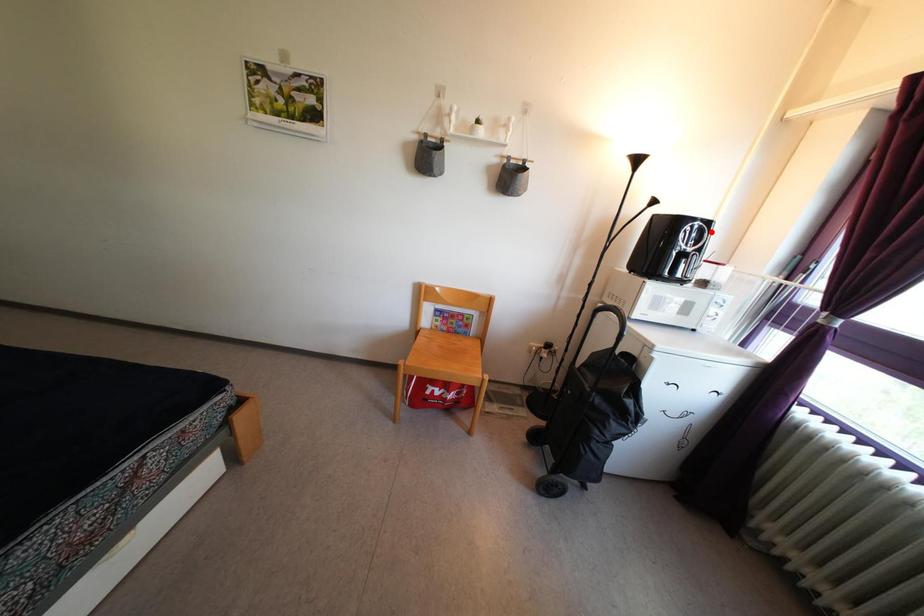
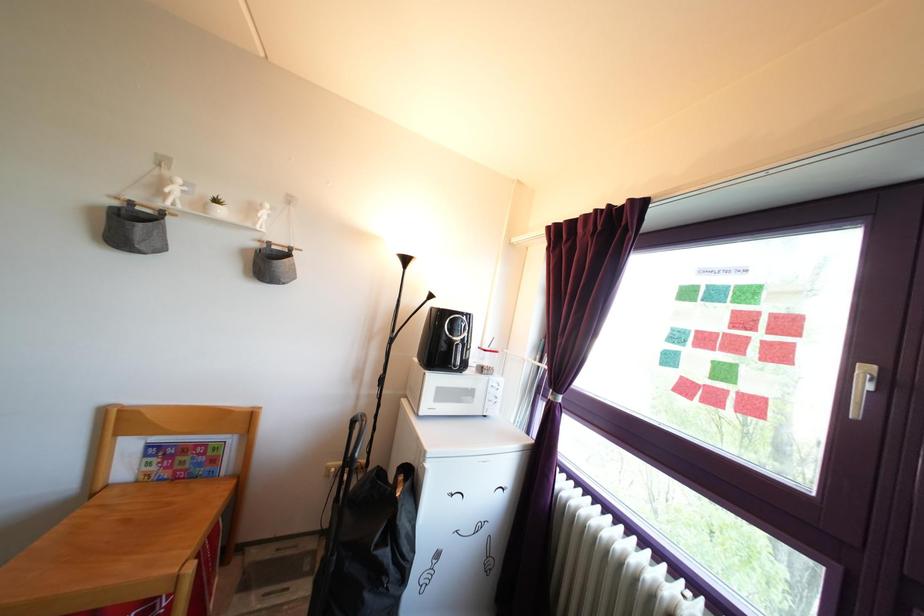
Where in the second image is the point corresponding to the highlighted location from the first image?

(470, 323)